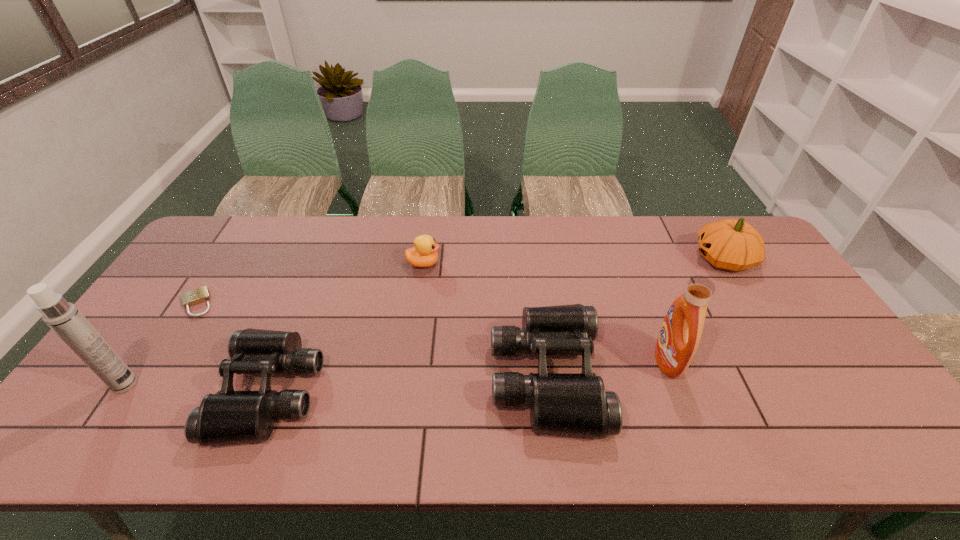
Find the location of a particular element. This screenshot has width=960, height=540. free region located on the front-facing side of the detergent is located at coordinates (617, 361).

This screenshot has height=540, width=960. I want to click on free space located 0.280m on the front-facing side of the detergent, so click(x=549, y=361).

Where is `free region located on the front-facing side of the detergent`? free region located on the front-facing side of the detergent is located at coordinates (633, 361).

Locate an element on the screen. This screenshot has height=540, width=960. vacant space located 0.400m on the right of the aerosol can is located at coordinates (297, 384).

The height and width of the screenshot is (540, 960). Identify the location of duckling situated at the far edge. (424, 254).

Where is `gourd that is at the far edge`? The width and height of the screenshot is (960, 540). gourd that is at the far edge is located at coordinates (729, 244).

Locate an element on the screen. detergent that is at the near edge is located at coordinates (680, 334).

Image resolution: width=960 pixels, height=540 pixels. What are the coordinates of `aerosol can that is at the near edge` in the screenshot? It's located at (63, 317).

Image resolution: width=960 pixels, height=540 pixels. What are the coordinates of `padlock that is at the left edge` in the screenshot? It's located at (201, 294).

The width and height of the screenshot is (960, 540). Find the location of `aerosol can at the left edge`. aerosol can at the left edge is located at coordinates (63, 317).